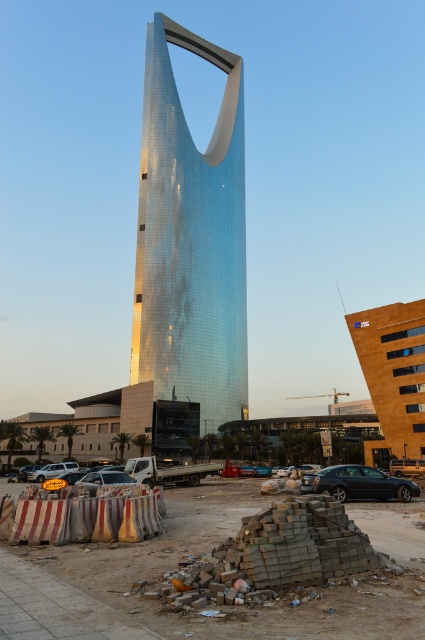
Question: Among these objects, which one is farthest from the camera?

Choices:
 (A) brick pile at lower center
 (B) silver metallic suv at lower left
 (C) shiny black sedan at lower right

Answer: (B)

Question: Is brick pile at lower center bigger than satin silver sedan at lower left?

Choices:
 (A) yes
 (B) no

Answer: (A)

Question: Estimate the real-world distances between objects in this image. Which object is farther from the shiny black sedan at lower right?

Choices:
 (A) silver metallic suv at lower left
 (B) glossy metallic tower at center
 (C) brick pile at lower center
 (D) brown brick pile at center

Answer: (B)

Question: Does shiny black sedan at lower right appear over satin silver sedan at lower left?

Choices:
 (A) no
 (B) yes

Answer: (A)

Question: Which object appears farthest from the camera in this image?

Choices:
 (A) shiny black sedan at lower right
 (B) brick pile at lower center

Answer: (A)

Question: Is the position of glossy metallic tower at center more distant than that of brick pile at lower center?

Choices:
 (A) yes
 (B) no

Answer: (A)